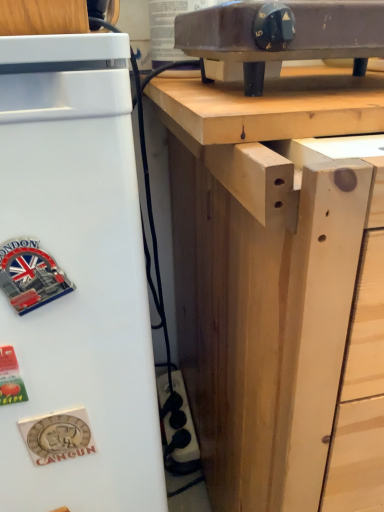
Question: Could you tell me if natural wood table at upper center is facing natural wood desk at upper center?

Choices:
 (A) yes
 (B) no

Answer: (B)

Question: Can you confirm if natural wood table at upper center is positioned to the right of natural wood desk at upper center?

Choices:
 (A) yes
 (B) no

Answer: (B)

Question: Can you confirm if natural wood table at upper center is positioned to the left of natural wood desk at upper center?

Choices:
 (A) yes
 (B) no

Answer: (A)

Question: Can you confirm if natural wood table at upper center is wider than natural wood desk at upper center?

Choices:
 (A) no
 (B) yes

Answer: (A)

Question: Would you say natural wood desk at upper center is part of natural wood table at upper center's contents?

Choices:
 (A) no
 (B) yes

Answer: (A)

Question: In terms of size, does matte black electric stove at upper center appear bigger or smaller than white matte refrigerator at left?

Choices:
 (A) big
 (B) small

Answer: (B)

Question: Considering their positions, is matte black electric stove at upper center located in front of or behind white matte refrigerator at left?

Choices:
 (A) front
 (B) behind

Answer: (B)

Question: From the image's perspective, relative to white matte refrigerator at left, is matte black electric stove at upper center above or below?

Choices:
 (A) below
 (B) above

Answer: (B)

Question: In terms of width, does matte black electric stove at upper center look wider or thinner when compared to white matte refrigerator at left?

Choices:
 (A) thin
 (B) wide

Answer: (A)

Question: In the image, is natural wood desk at upper center positioned in front of or behind natural wood table at upper center?

Choices:
 (A) front
 (B) behind

Answer: (A)

Question: Looking at their shapes, would you say natural wood desk at upper center is wider or thinner than natural wood table at upper center?

Choices:
 (A) wide
 (B) thin

Answer: (A)

Question: Does point (331, 448) appear closer or farther from the camera than point (180, 124)?

Choices:
 (A) closer
 (B) farther

Answer: (A)

Question: In terms of size, does natural wood desk at upper center appear bigger or smaller than natural wood table at upper center?

Choices:
 (A) big
 (B) small

Answer: (A)

Question: From their relative heights in the image, would you say natural wood table at upper center is taller or shorter than matte black electric stove at upper center?

Choices:
 (A) short
 (B) tall

Answer: (A)

Question: Is point (299, 69) closer or farther from the camera than point (221, 30)?

Choices:
 (A) farther
 (B) closer

Answer: (A)